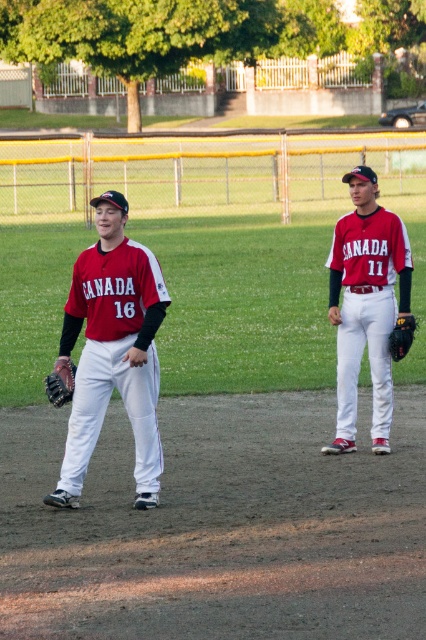
Measure the distance between point (379,282) and camera.

Point (379,282) and camera are 10.33 meters apart.

Can you confirm if matte red baseball uniform at right is positioned to the right of brown leather glove at left?

Yes, matte red baseball uniform at right is to the right of brown leather glove at left.

Based on the photo, measure the distance between matte red baseball uniform at right and camera.

The distance of matte red baseball uniform at right from camera is 10.05 meters.

At what (x,y) coordinates should I click in order to perform the action: click on matte red baseball uniform at right. Please return your answer as a coordinate pair (x, y). This screenshot has height=640, width=426. Looking at the image, I should click on (368, 307).

Is matte red jersey at left above matte red baseball uniform at right?

Incorrect, matte red jersey at left is not positioned above matte red baseball uniform at right.

Which is below, matte red jersey at left or matte red baseball uniform at right?

matte red jersey at left is lower down.

Which is behind, point (97, 342) or point (385, 346)?

The point (385, 346) is behind.

Locate an element on the screen. This screenshot has width=426, height=640. matte red jersey at left is located at coordinates (112, 352).

Between point (362, 316) and point (405, 348), which one is positioned in front?

Point (405, 348) is in front.

Which is below, matte red baseball uniform at right or black leather glove at right?

black leather glove at right is lower down.

Where is `matte red baseball uniform at right`? matte red baseball uniform at right is located at coordinates (368, 307).